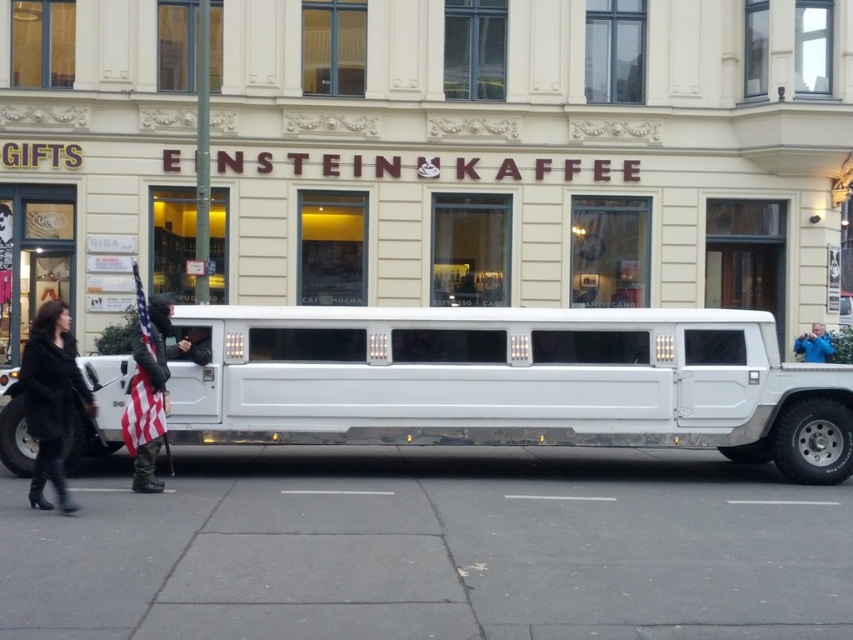
How distant is black leather coat at lower left from american flag fabric at center?

black leather coat at lower left and american flag fabric at center are 1.31 meters apart from each other.

Who is positioned more to the right, black leather coat at lower left or american flag fabric at center?

american flag fabric at center

Between point (22, 369) and point (149, 451), which one is positioned in front?

Point (22, 369)

The width and height of the screenshot is (853, 640). Find the location of `black leather coat at lower left`. black leather coat at lower left is located at coordinates tap(50, 397).

Does gray asphalt pavement at lower center have a lesser height compared to blue fabric jacket at center?

Correct, gray asphalt pavement at lower center is not as tall as blue fabric jacket at center.

Which is below, gray asphalt pavement at lower center or blue fabric jacket at center?

gray asphalt pavement at lower center

Which is behind, point (726, 620) or point (817, 346)?

Point (817, 346)

Locate an element on the screen. gray asphalt pavement at lower center is located at coordinates (432, 548).

Can you confirm if white matte limousine at center is positioned to the left of blue fabric jacket at center?

Yes, white matte limousine at center is to the left of blue fabric jacket at center.

Who is shorter, white matte limousine at center or blue fabric jacket at center?

With less height is white matte limousine at center.

This screenshot has height=640, width=853. Find the location of `white matte limousine at center`. white matte limousine at center is located at coordinates (509, 381).